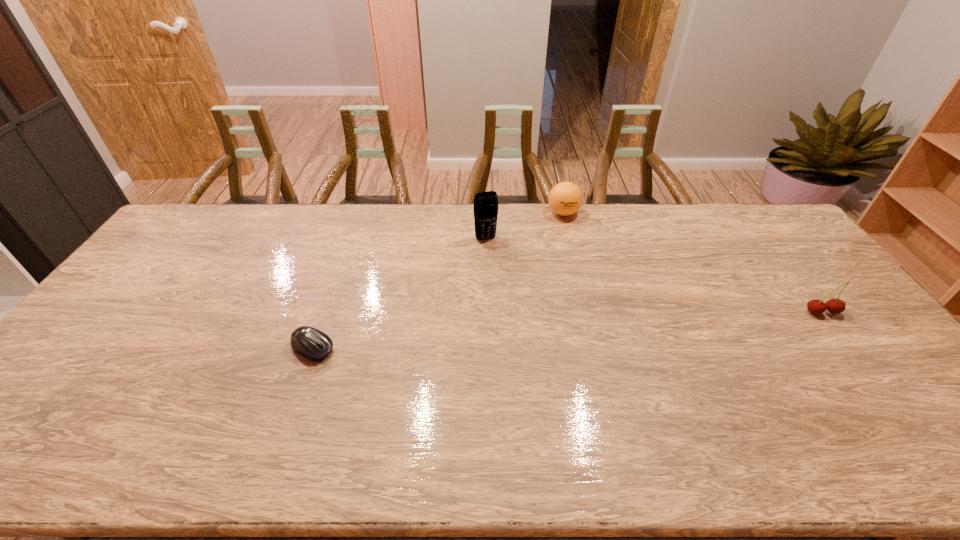
The height and width of the screenshot is (540, 960). In order to click on the leftmost object in this screenshot , I will do [x=310, y=342].

Identify the location of the shortest object. (310, 342).

Where is `cherry`? This screenshot has height=540, width=960. cherry is located at coordinates (835, 306).

Where is `the rightmost object`? the rightmost object is located at coordinates (835, 306).

Where is `the farthest object`? The height and width of the screenshot is (540, 960). the farthest object is located at coordinates (565, 198).

Where is `the third object from left to right`? The height and width of the screenshot is (540, 960). the third object from left to right is located at coordinates (565, 198).

Where is `the third object from right to left`? the third object from right to left is located at coordinates (485, 203).

The image size is (960, 540). I want to click on the second farthest object, so click(485, 203).

Find the location of `blank space located 0.290m on the left of the nearest object`. blank space located 0.290m on the left of the nearest object is located at coordinates (183, 348).

At what (x,y) coordinates should I click in order to perform the action: click on vacant area situated on the surface of the cherry. Please return your answer as a coordinate pair (x, y). The image size is (960, 540). Looking at the image, I should click on (846, 343).